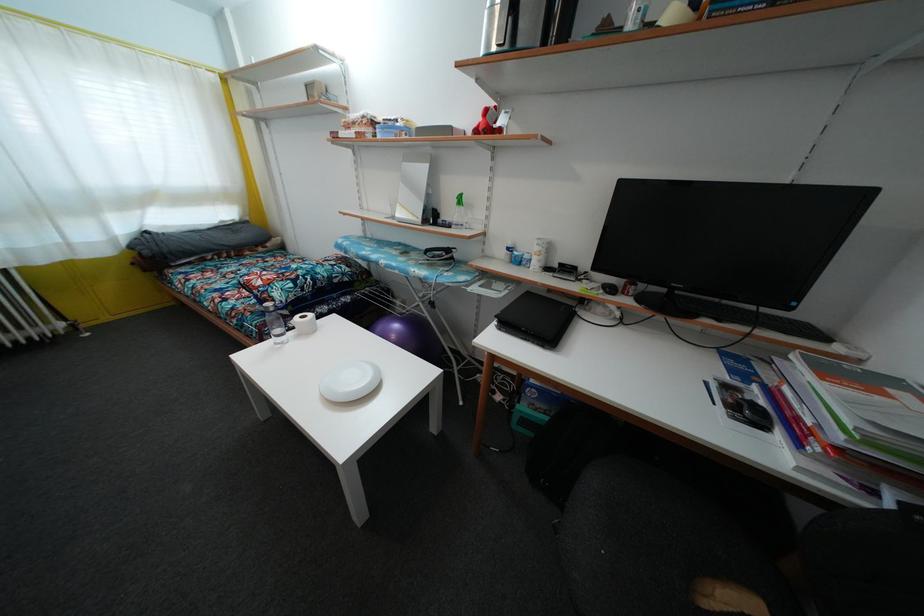
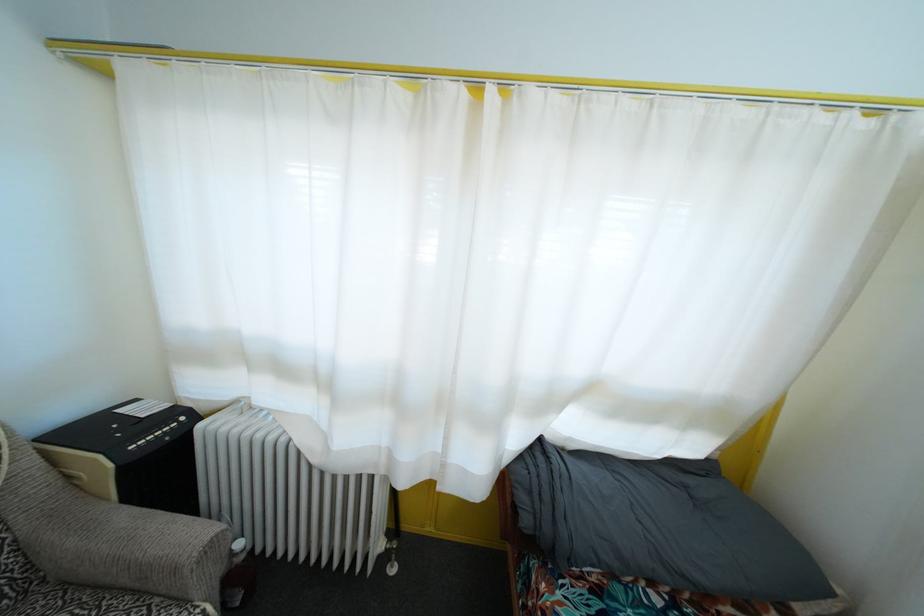
The point at (150, 259) is marked in the first image. Where is the corresponding point in the second image?

(529, 528)